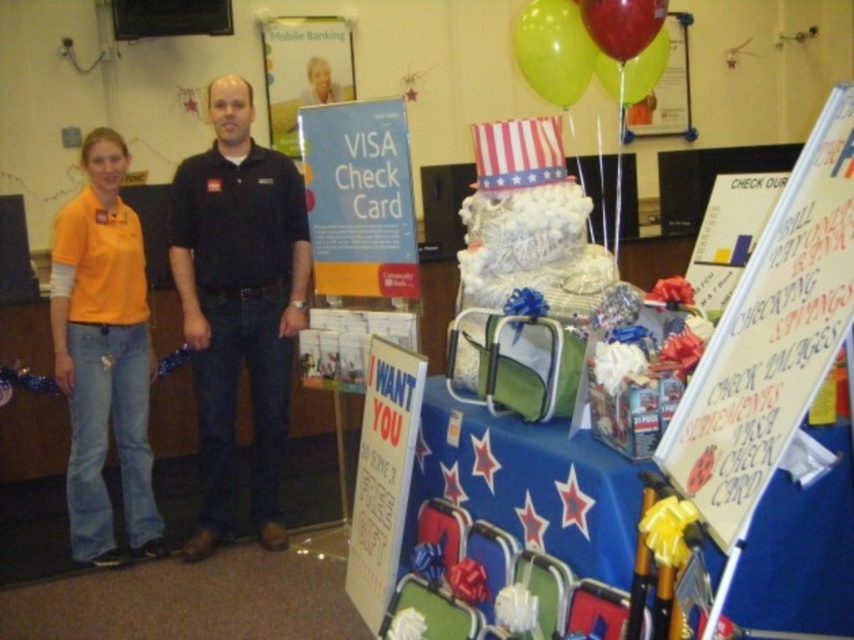
Is black cotton shirt at center wider than orange cotton shirt at left?

Indeed, black cotton shirt at center has a greater width compared to orange cotton shirt at left.

Between point (258, 173) and point (80, 509), which one is positioned behind?

The point (258, 173) is behind.

Is point (262, 486) positioned after point (108, 184)?

Yes, point (262, 486) is behind point (108, 184).

You are a GUI agent. You are given a task and a screenshot of the screen. Output one action in this format:
    pyautogui.click(x=<x>, y=<y>)
    Task: Click on the black cotton shirt at center
    
    Given the screenshot: What is the action you would take?
    pyautogui.click(x=238, y=304)

Is shiny metallic balloon at upper center bigger than red glossy balloon at upper center?

Actually, shiny metallic balloon at upper center might be smaller than red glossy balloon at upper center.

Does point (640, 8) come farther from viewer compared to point (632, 81)?

No, (640, 8) is closer to viewer.

Find the location of `shiny metallic balloon at upper center`. shiny metallic balloon at upper center is located at coordinates (623, 24).

Which is below, black cotton shirt at center or green rubber balloon at upper center?

black cotton shirt at center is below.

Is black cotton shirt at center positioned in front of green rubber balloon at upper center?

No, black cotton shirt at center is behind green rubber balloon at upper center.

Where is `black cotton shirt at center`? The height and width of the screenshot is (640, 854). black cotton shirt at center is located at coordinates (238, 304).

This screenshot has width=854, height=640. What are the coordinates of `black cotton shirt at center` in the screenshot? It's located at (238, 304).